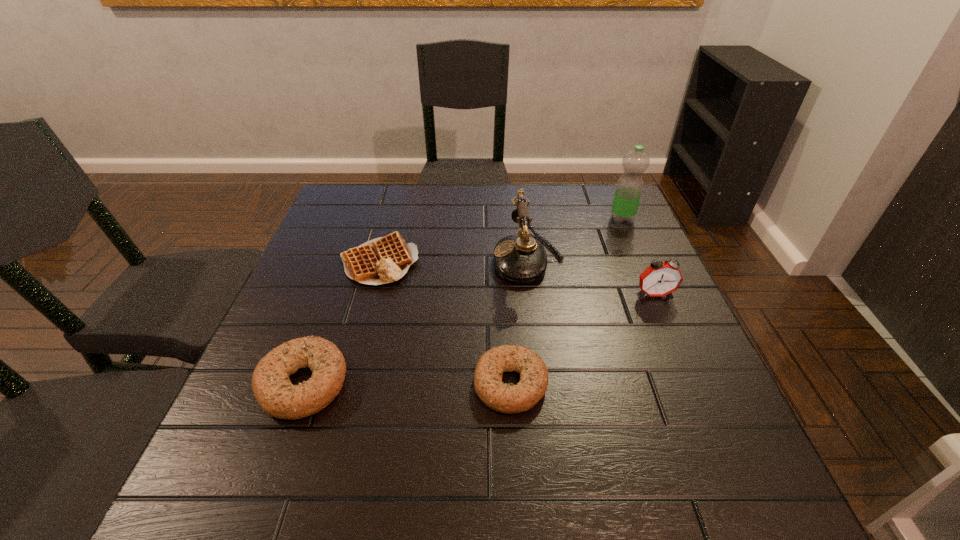
The image size is (960, 540). Identify the location of the fourth tallest object. (276, 395).

The width and height of the screenshot is (960, 540). In order to click on the left bagel in this screenshot , I will do `click(276, 395)`.

Identify the location of the right bagel. (533, 382).

Where is `telephone`? telephone is located at coordinates (521, 259).

Where is `waffle`? The width and height of the screenshot is (960, 540). waffle is located at coordinates (383, 260).

Identify the location of the farthest object. tap(629, 187).

This screenshot has width=960, height=540. In order to click on water bottle in this screenshot , I will do pyautogui.click(x=629, y=187).

This screenshot has height=540, width=960. I want to click on alarm clock, so click(x=660, y=279).

Locate an element on the screen. This screenshot has height=540, width=960. vacant space located 0.350m on the back of the taller bagel is located at coordinates pos(352,247).

Find the location of a particular element. This screenshot has height=540, width=960. vacant space located 0.300m on the back of the right bagel is located at coordinates (503, 262).